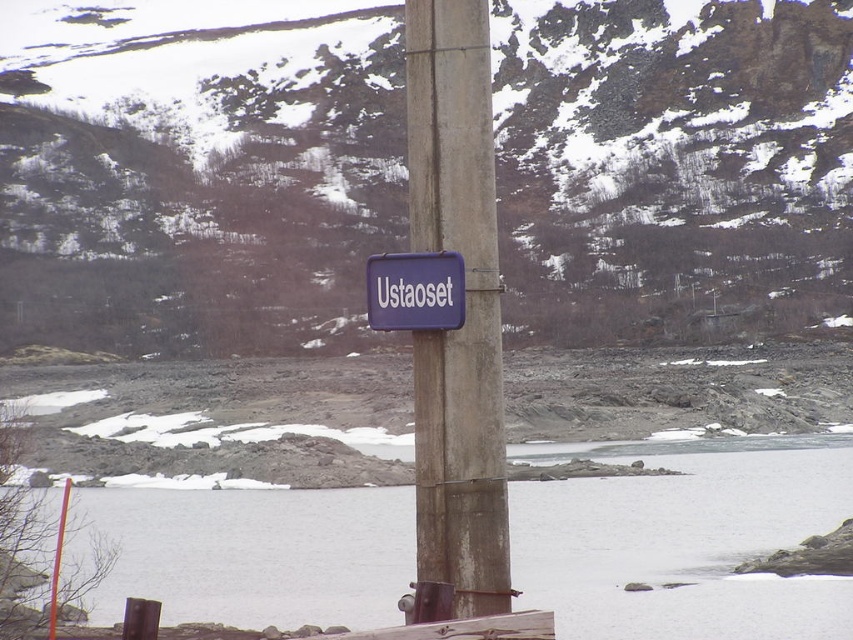
You are a hiker who wants to place a small flag on the highest point between the matte gray rock at center and the rusty concrete pole at center. Which object should you choose to place the flag on?

The matte gray rock at center is located above the rusty concrete pole at center, so you should place the flag on the matte gray rock at center as it is higher.

You are a hiker looking at the winter landscape. You see the rusty concrete pole at center and the purple matte sign at center. Which object is positioned lower in the scene?

The rusty concrete pole at center is located below the purple matte sign at center, so it is positioned lower in the scene.